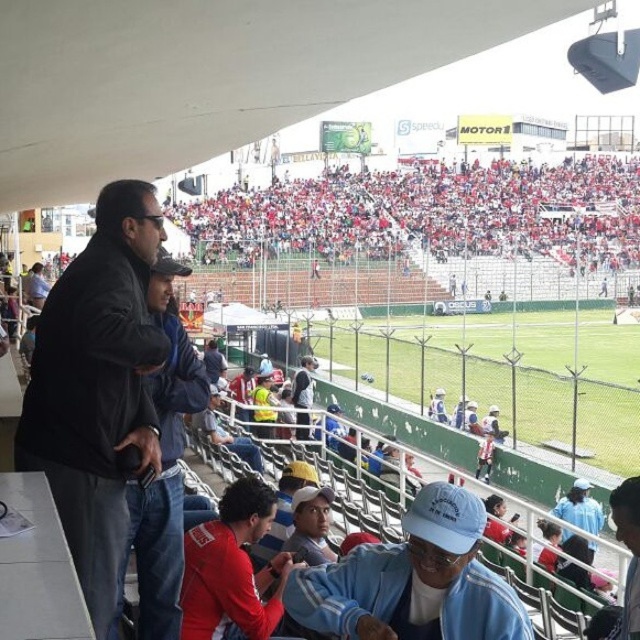
Question: Is the position of light blue fabric jacket at lower center more distant than that of dark gray jacket at center?

Choices:
 (A) yes
 (B) no

Answer: (B)

Question: Which of these objects is positioned closest to the red matte shirt at lower center?

Choices:
 (A) dark blue jacket at center
 (B) light blue fabric jacket at lower center
 (C) dark gray jacket at center
 (D) red fabric seats at upper center

Answer: (B)

Question: Can you confirm if red fabric seats at upper center is smaller than dark blue jacket at center?

Choices:
 (A) yes
 (B) no

Answer: (B)

Question: Estimate the real-world distances between objects in this image. Which object is closer to the light blue fabric jacket at lower center?

Choices:
 (A) dark blue jacket at center
 (B) black leather jacket at left

Answer: (A)

Question: Which object is closer to the camera taking this photo?

Choices:
 (A) red matte shirt at lower center
 (B) dark gray jacket at center
 (C) light blue fabric jacket at lower center

Answer: (C)

Question: Is black leather jacket at left wider than dark blue jacket at center?

Choices:
 (A) no
 (B) yes

Answer: (B)